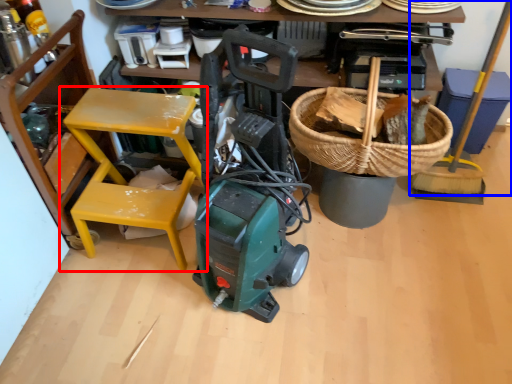
Question: Which of the following is the farthest to the observer, chair (highlighted by a red box) or shovel (highlighted by a blue box)?

Choices:
 (A) chair
 (B) shovel

Answer: (B)